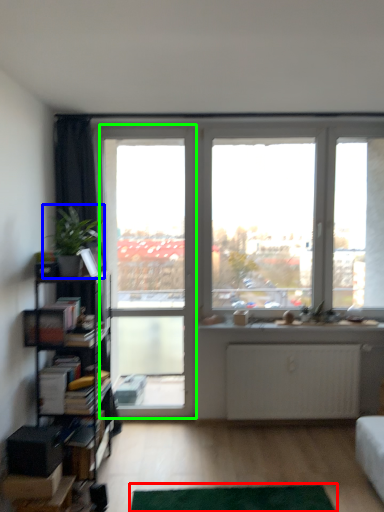
Question: Estimate the real-world distances between objects in this image. Which object is farther from flat (highlighted by a red box), houseplant (highlighted by a blue box) or screen door (highlighted by a green box)?

Choices:
 (A) houseplant
 (B) screen door

Answer: (B)